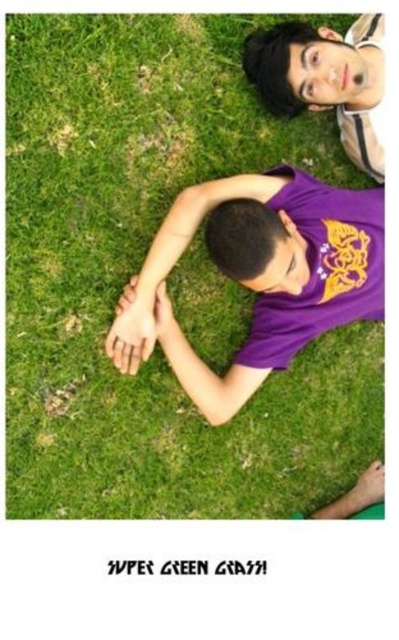
You are planning to place a small decorative rock on the green grass at upper center. However, you need to ensure it won not land on the purple matte shirt at center. Based on their positions, is this possible?

The green grass at upper center is located above the purple matte shirt at center, so placing the rock on the green grass at upper center would not cause it to land on the purple matte shirt at center since it is positioned higher up.

You are a photographer setting up a shot of two people lying on the grass. You need to ensure the green grass at upper center and the matte purple shirt at upper center are both visible in the frame. Based on their positions, which object is closer to the left edge of the photo?

The green grass at upper center is positioned on the left side of matte purple shirt at upper center, so the green grass at upper center is closer to the left edge of the photo.